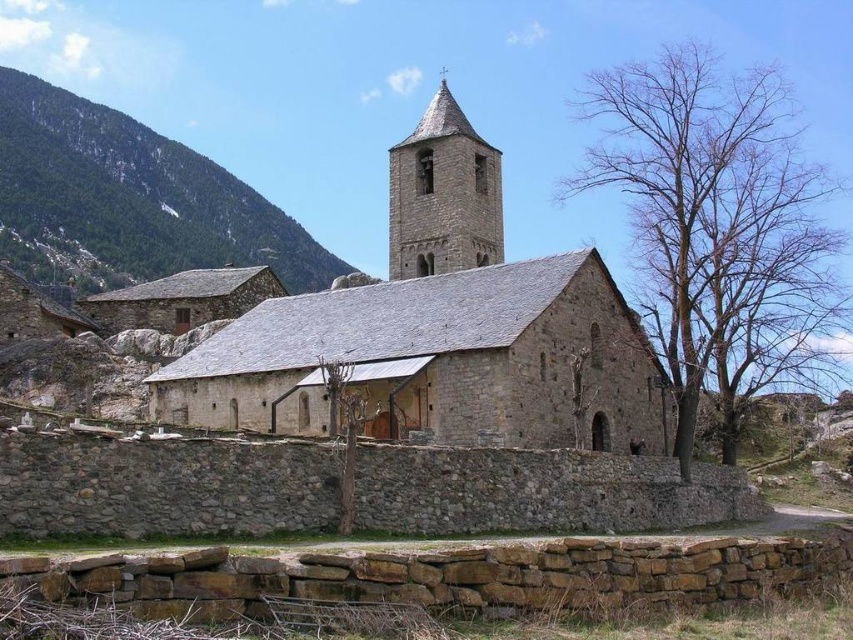
Question: Considering the real-world distances, which object is closest to the smooth stone tower at upper center?

Choices:
 (A) green forested mountain at upper left
 (B) gray stone church at center

Answer: (B)

Question: Is gray stone church at center closer to the viewer compared to smooth stone tower at upper center?

Choices:
 (A) yes
 (B) no

Answer: (A)

Question: Among these objects, which one is farthest from the camera?

Choices:
 (A) green forested mountain at upper left
 (B) smooth stone tower at upper center

Answer: (A)

Question: Which object appears closest to the camera in this image?

Choices:
 (A) green forested mountain at upper left
 (B) gray stone church at center
 (C) smooth stone tower at upper center

Answer: (B)

Question: Does gray stone church at center appear on the right side of smooth stone tower at upper center?

Choices:
 (A) no
 (B) yes

Answer: (A)

Question: Can you confirm if green forested mountain at upper left is smaller than smooth stone tower at upper center?

Choices:
 (A) no
 (B) yes

Answer: (A)